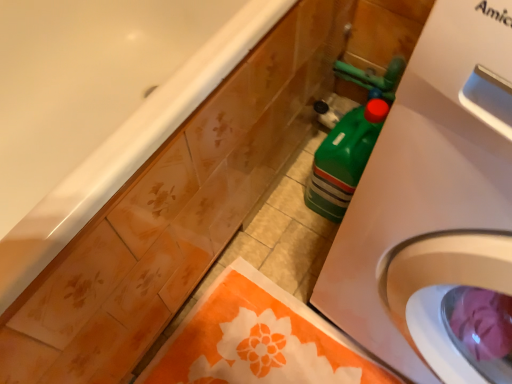
Question: Considering the relative positions of orange fabric towel at lower center and white glossy bathtub at upper left in the image provided, is orange fabric towel at lower center to the right of white glossy bathtub at upper left from the viewer's perspective?

Choices:
 (A) no
 (B) yes

Answer: (B)

Question: From the image's perspective, does orange fabric towel at lower center appear lower than white glossy bathtub at upper left?

Choices:
 (A) yes
 (B) no

Answer: (A)

Question: Is the position of orange fabric towel at lower center more distant than that of white glossy bathtub at upper left?

Choices:
 (A) no
 (B) yes

Answer: (B)

Question: Does orange fabric towel at lower center have a greater width compared to white glossy bathtub at upper left?

Choices:
 (A) yes
 (B) no

Answer: (B)

Question: Is orange fabric towel at lower center facing towards white glossy bathtub at upper left?

Choices:
 (A) no
 (B) yes

Answer: (A)

Question: Is orange fabric towel at lower center positioned with its back to white glossy bathtub at upper left?

Choices:
 (A) yes
 (B) no

Answer: (B)

Question: Would you consider white plastic washing machine at right to be distant from orange fabric towel at lower center?

Choices:
 (A) no
 (B) yes

Answer: (A)

Question: From the image's perspective, is white plastic washing machine at right beneath orange fabric towel at lower center?

Choices:
 (A) yes
 (B) no

Answer: (B)

Question: Can you confirm if white plastic washing machine at right is bigger than orange fabric towel at lower center?

Choices:
 (A) yes
 (B) no

Answer: (A)

Question: Can you confirm if white plastic washing machine at right is shorter than orange fabric towel at lower center?

Choices:
 (A) no
 (B) yes

Answer: (A)

Question: Does white plastic washing machine at right come behind orange fabric towel at lower center?

Choices:
 (A) yes
 (B) no

Answer: (B)

Question: Would you say orange fabric towel at lower center is part of white plastic washing machine at right's contents?

Choices:
 (A) no
 (B) yes

Answer: (A)

Question: Is orange fabric towel at lower center positioned beyond the bounds of white plastic washing machine at right?

Choices:
 (A) no
 (B) yes

Answer: (B)